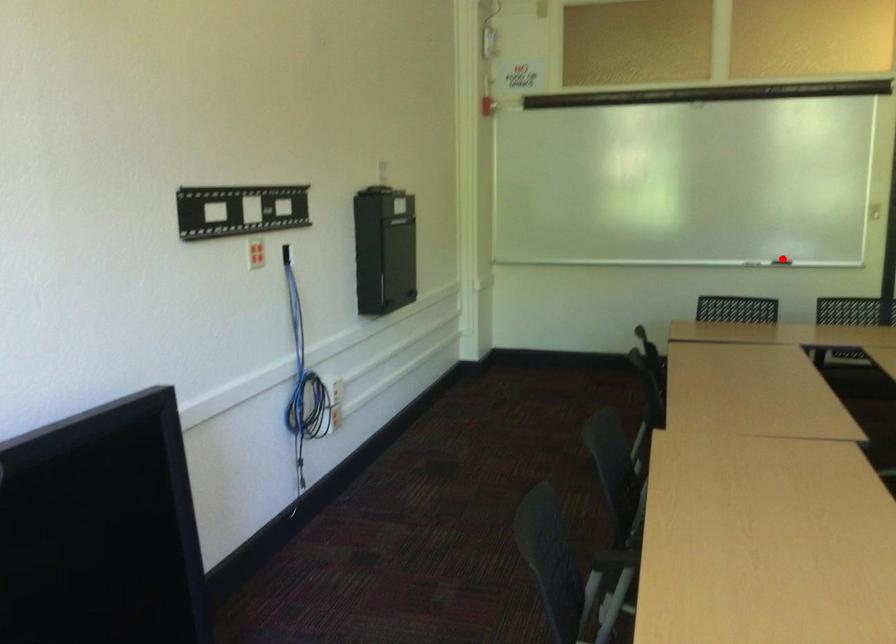
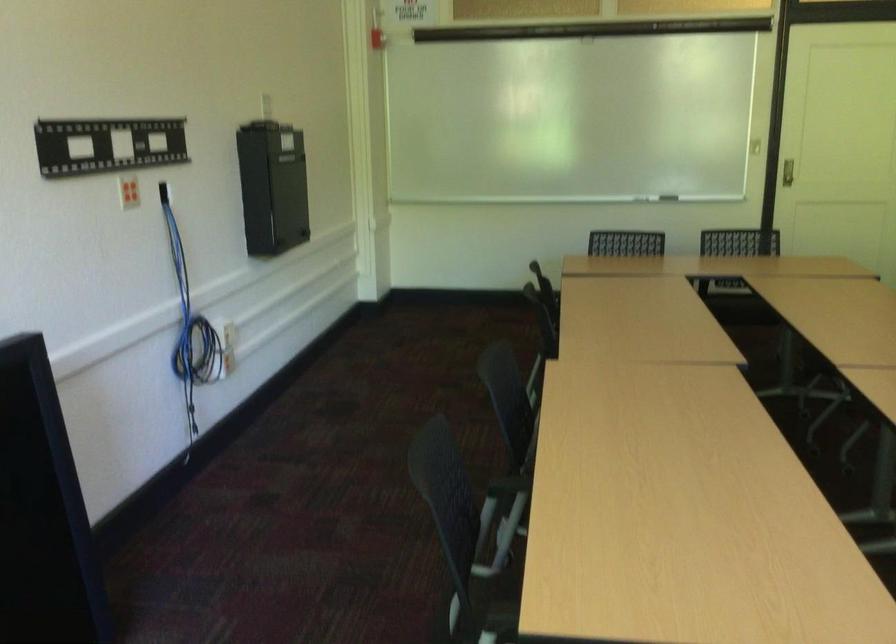
Where in the second image is the point corresponding to the highlighted location from the first image?

(668, 198)